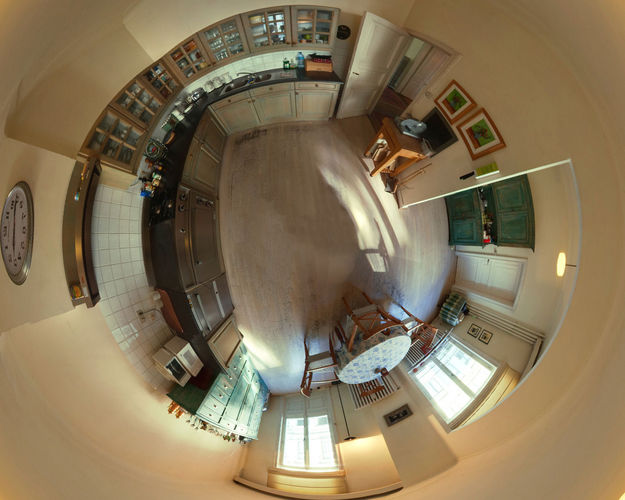
I want to click on picture, so pyautogui.click(x=462, y=100), pyautogui.click(x=477, y=121).